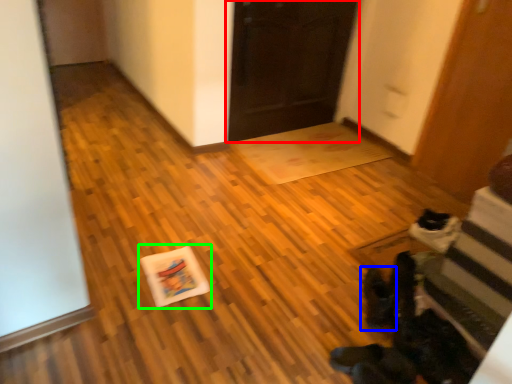
Question: Estimate the real-world distances between objects in this image. Which object is farther from door (highlighted by a red box), footwear (highlighted by a blue box) or postcard (highlighted by a green box)?

Choices:
 (A) footwear
 (B) postcard

Answer: (A)